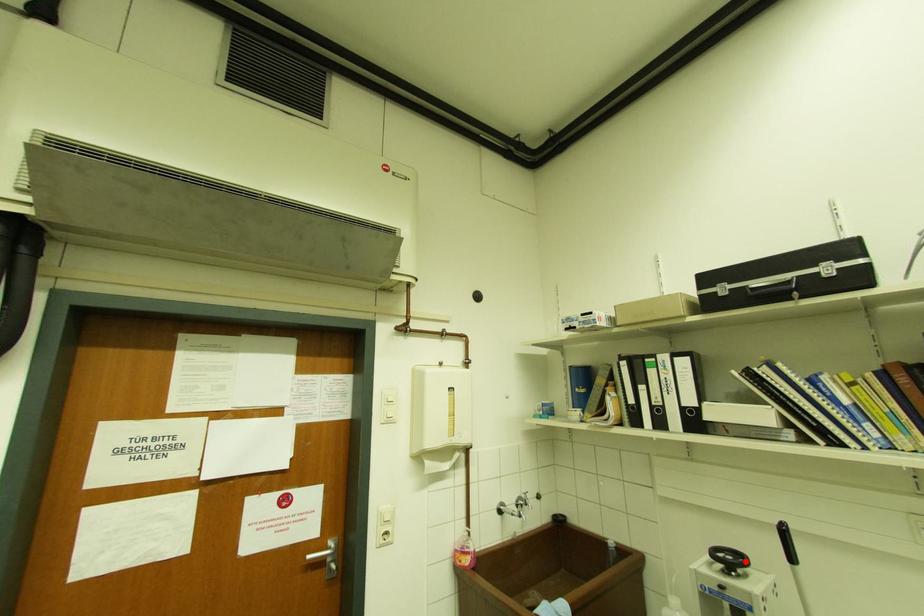
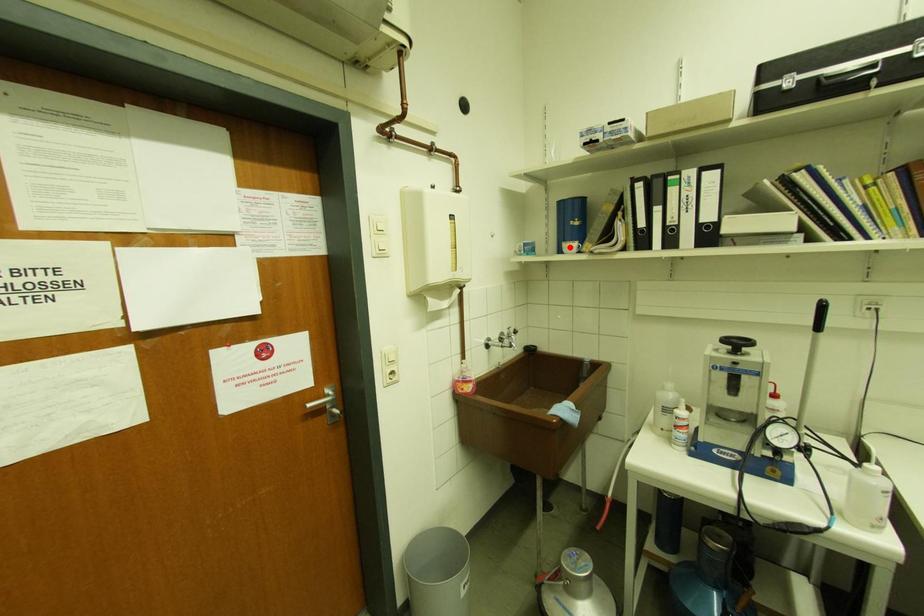
I am providing you with two images of the same scene from different viewpoints. A red point is marked on the first image and another point is marked on the second image. Are the points marked in image1 and image2 representing the same 3D position?

No